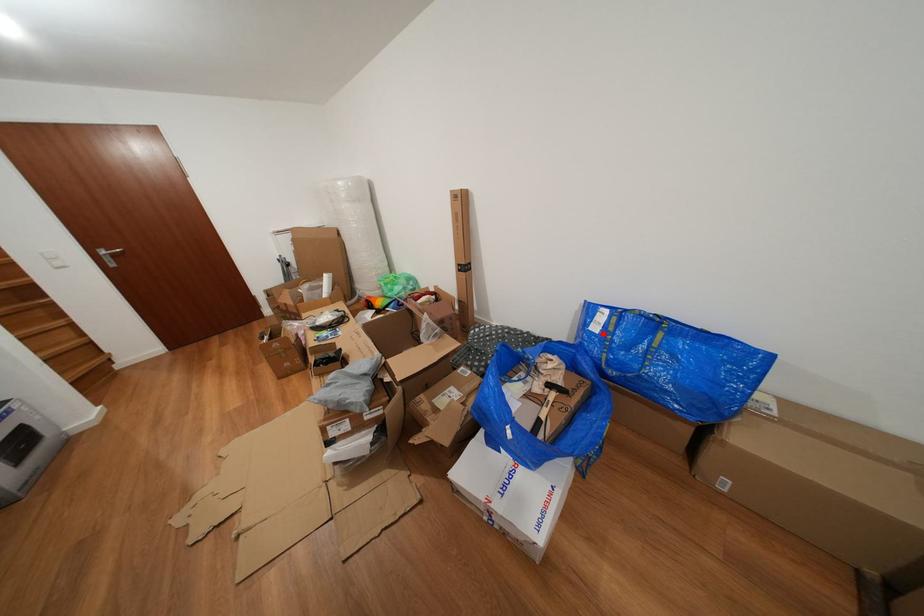
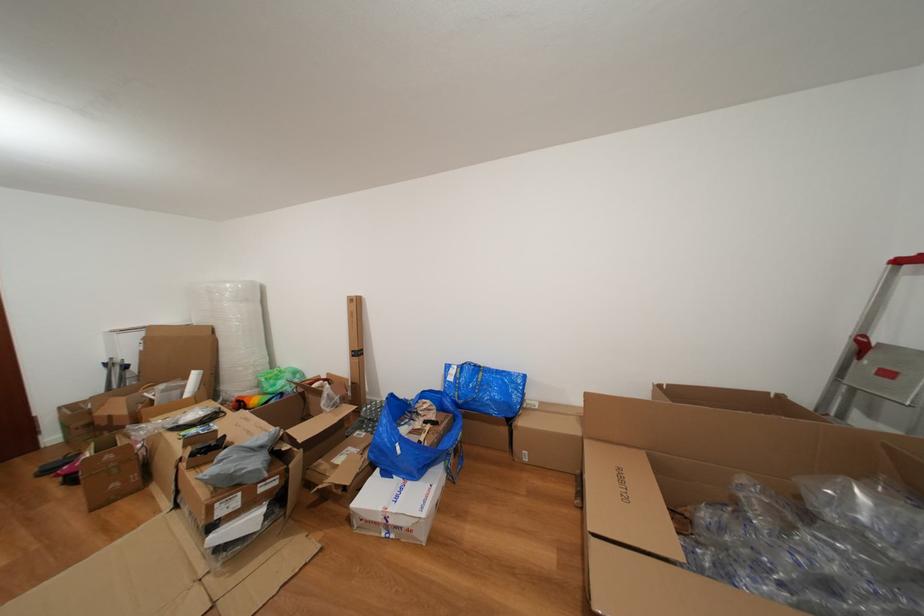
Locate, in the second image, the point that corresponds to the highlighted location in the first image.

(458, 384)